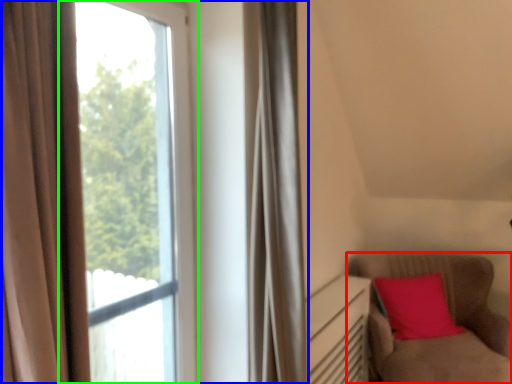
Question: Based on their relative distances, which object is farther from furniture (highlighted by a red box)? Choose from window (highlighted by a blue box) and window (highlighted by a green box).

Choices:
 (A) window
 (B) window

Answer: (A)